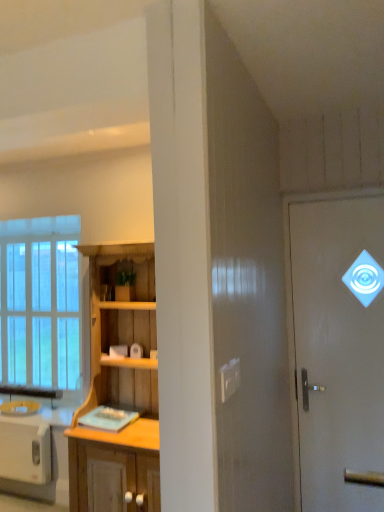
In order to face wooden cabinet at center, should I rotate leftwards or rightwards?

Rotate your view left by about 8.972°.

This screenshot has height=512, width=384. What do you see at coordinates (119, 390) in the screenshot? I see `wooden cabinet at center` at bounding box center [119, 390].

Describe the element at coordinates (336, 353) in the screenshot. The height and width of the screenshot is (512, 384). I see `white glossy door at upper right` at that location.

Where is `wooden cabinet at center`? This screenshot has width=384, height=512. wooden cabinet at center is located at coordinates (119, 390).

From the image's perspective, is wooden cabinet at center positioned above or below white glossy door at upper right?

wooden cabinet at center is below white glossy door at upper right.

Is wooden cabinet at center bigger than white glossy door at upper right?

Yes.

Consider the image. From a real-world perspective, is wooden cabinet at center positioned over white glossy door at upper right based on gravity?

No, from a real-world perspective, wooden cabinet at center is not over white glossy door at upper right

Is wooden cabinet at center at the left side of clear glass window at left?

In fact, wooden cabinet at center is to the right of clear glass window at left.

Where is `cabinetry below the clear glass window at left (from the image's perspective)`? Image resolution: width=384 pixels, height=512 pixels. cabinetry below the clear glass window at left (from the image's perspective) is located at coordinates (119, 390).

Considering the relative sizes of wooden cabinet at center and clear glass window at left in the image provided, is wooden cabinet at center taller than clear glass window at left?

Yes, wooden cabinet at center is taller than clear glass window at left.

Considering the relative sizes of wooden cabinet at center and clear glass window at left in the image provided, is wooden cabinet at center bigger than clear glass window at left?

Correct, wooden cabinet at center is larger in size than clear glass window at left.

From a real-world perspective, which object rests below the other?

In real-world perspective, white glossy toaster at lower left is lower.

From their relative heights in the image, would you say wooden cabinet at center is taller or shorter than white glossy toaster at lower left?

wooden cabinet at center is taller than white glossy toaster at lower left.

From the image's perspective, which is below, wooden cabinet at center or white glossy toaster at lower left?

white glossy toaster at lower left appears lower in the image.

Which of these two, clear glass window at left or white glossy toaster at lower left, is thinner?

With smaller width is clear glass window at left.

From the picture: Considering the sizes of objects clear glass window at left and white glossy toaster at lower left in the image provided, who is smaller, clear glass window at left or white glossy toaster at lower left?

white glossy toaster at lower left.

Between clear glass window at left and white glossy toaster at lower left, which one has less height?

Standing shorter between the two is white glossy toaster at lower left.

Is white glossy door at upper right not close to clear glass window at left?

white glossy door at upper right is positioned a significant distance from clear glass window at left.

Does white glossy door at upper right appear on the right side of clear glass window at left?

Correct, you'll find white glossy door at upper right to the right of clear glass window at left.

Image resolution: width=384 pixels, height=512 pixels. In order to click on window that is above the white glossy door at upper right (from the image's perspective) in this screenshot , I will do `click(40, 302)`.

In terms of height, does white glossy door at upper right look taller or shorter compared to clear glass window at left?

Considering their sizes, white glossy door at upper right has more height than clear glass window at left.

Is white glossy toaster at lower left looking in the opposite direction of clear glass window at left?

No, white glossy toaster at lower left is not facing away from clear glass window at left.

Is white glossy toaster at lower left next to clear glass window at left and touching it?

white glossy toaster at lower left and clear glass window at left are clearly separated.

Considering the sizes of objects white glossy toaster at lower left and clear glass window at left in the image provided, who is shorter, white glossy toaster at lower left or clear glass window at left?

white glossy toaster at lower left.

How different are the orientations of white glossy toaster at lower left and white glossy door at upper right in degrees?

They differ by 1.69 degrees in their facing directions.

From the image's perspective, is white glossy toaster at lower left on top of white glossy door at upper right?

No.

Identify the location of appliance behind the white glossy door at upper right. (25, 450).

Considering the positions of objects white glossy toaster at lower left and white glossy door at upper right in the image provided, who is more to the left, white glossy toaster at lower left or white glossy door at upper right?

Positioned to the left is white glossy toaster at lower left.

At what (x,y) coordinates should I click in order to perform the action: click on cabinetry located below the white glossy door at upper right (from the image's perspective). Please return your answer as a coordinate pair (x, y). Image resolution: width=384 pixels, height=512 pixels. Looking at the image, I should click on [x=119, y=390].

Where is `cabinetry that appears below the clear glass window at left (from a real-world perspective)`? cabinetry that appears below the clear glass window at left (from a real-world perspective) is located at coordinates (119, 390).

Looking at the image, which one is located closer to wooden cabinet at center, white glossy toaster at lower left or white glossy door at upper right?

Based on the image, white glossy door at upper right appears to be nearer to wooden cabinet at center.

Looking at the image, which one is located closer to wooden cabinet at center, white glossy door at upper right or clear glass window at left?

white glossy door at upper right lies closer to wooden cabinet at center than the other object.

From the image, which object appears to be nearer to clear glass window at left, white glossy toaster at lower left or white glossy door at upper right?

white glossy toaster at lower left is closer to clear glass window at left.

From the image, which object appears to be farther from white glossy toaster at lower left, wooden cabinet at center or clear glass window at left?

The object further to white glossy toaster at lower left is wooden cabinet at center.

Which object lies nearer to the anchor point wooden cabinet at center, clear glass window at left or white glossy door at upper right?

white glossy door at upper right is positioned closer to the anchor wooden cabinet at center.

Based on their spatial positions, is wooden cabinet at center or white glossy door at upper right further from clear glass window at left?

The object further to clear glass window at left is white glossy door at upper right.

When comparing their distances from white glossy toaster at lower left, does clear glass window at left or white glossy door at upper right seem further?

The object further to white glossy toaster at lower left is white glossy door at upper right.

Looking at the image, which one is located closer to white glossy toaster at lower left, wooden cabinet at center or white glossy door at upper right?

The object closer to white glossy toaster at lower left is wooden cabinet at center.

At what (x,y) coordinates should I click in order to perform the action: click on appliance situated between clear glass window at left and white glossy door at upper right from left to right. Please return your answer as a coordinate pair (x, y). The image size is (384, 512). Looking at the image, I should click on (25, 450).

Locate an element on the screen. This screenshot has height=512, width=384. cabinetry located between clear glass window at left and white glossy door at upper right in the left-right direction is located at coordinates (119, 390).

Image resolution: width=384 pixels, height=512 pixels. What are the coordinates of `cabinetry located between white glossy toaster at lower left and white glossy door at upper right in the left-right direction` in the screenshot? It's located at (119, 390).

Where is `appliance between wooden cabinet at center and clear glass window at left along the z-axis`? The image size is (384, 512). appliance between wooden cabinet at center and clear glass window at left along the z-axis is located at coordinates (25, 450).